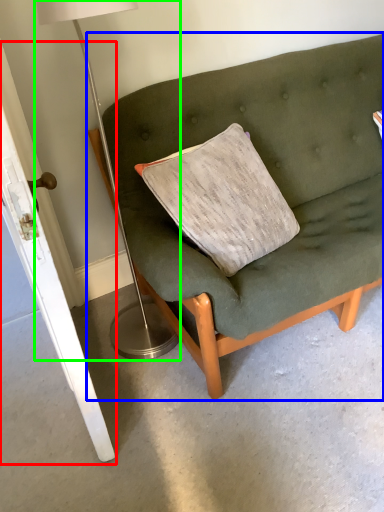
Question: Considering the real-world distances, which object is farthest from door (highlighted by a red box)? studio couch (highlighted by a blue box) or table lamp (highlighted by a green box)?

Choices:
 (A) studio couch
 (B) table lamp

Answer: (A)